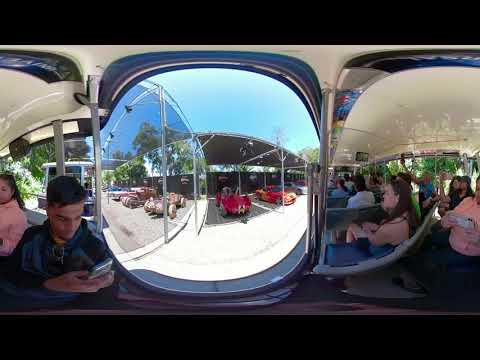
Locate an element on the screen. window is located at coordinates (253, 124).